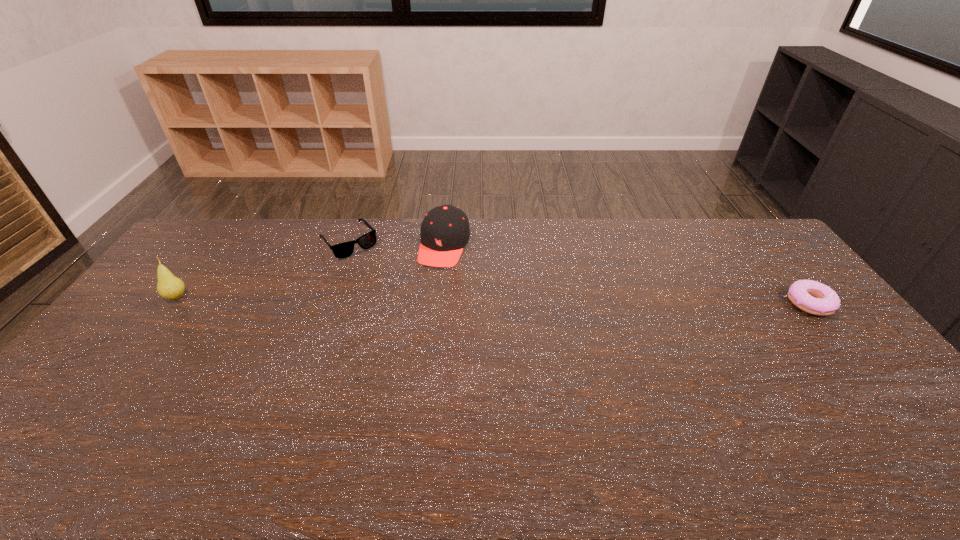
In the image, there is a desktop. At what (x,y) coordinates should I click in order to perform the action: click on vacant space at the near edge. Please return your answer as a coordinate pair (x, y). The width and height of the screenshot is (960, 540). Looking at the image, I should click on (828, 418).

Find the location of a particular element. The image size is (960, 540). vacant space at the left edge of the desktop is located at coordinates (150, 334).

In the image, there is a desktop. Where is `vacant space at the far left corner`? Image resolution: width=960 pixels, height=540 pixels. vacant space at the far left corner is located at coordinates (188, 254).

In the image, there is a desktop. Where is `vacant space at the far right corner`? vacant space at the far right corner is located at coordinates (729, 225).

Where is `vacant area at the near right corner of the desktop`? The height and width of the screenshot is (540, 960). vacant area at the near right corner of the desktop is located at coordinates (913, 418).

I want to click on vacant area between the leftmost object and the sunglasses, so click(x=262, y=269).

Where is `free space between the sunglasses and the second object from right to left`? free space between the sunglasses and the second object from right to left is located at coordinates (396, 244).

Locate an element on the screen. The width and height of the screenshot is (960, 540). free space between the cap and the leftmost object is located at coordinates [311, 272].

The height and width of the screenshot is (540, 960). I want to click on free space between the pear and the second object from right to left, so click(311, 272).

Find the location of a particular element. free spot between the rightmost object and the cap is located at coordinates (627, 274).